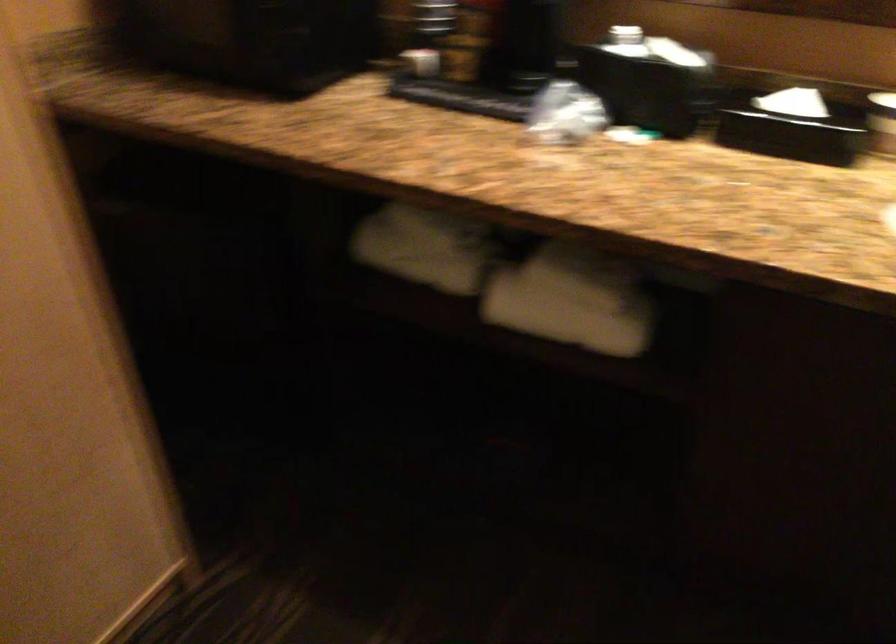
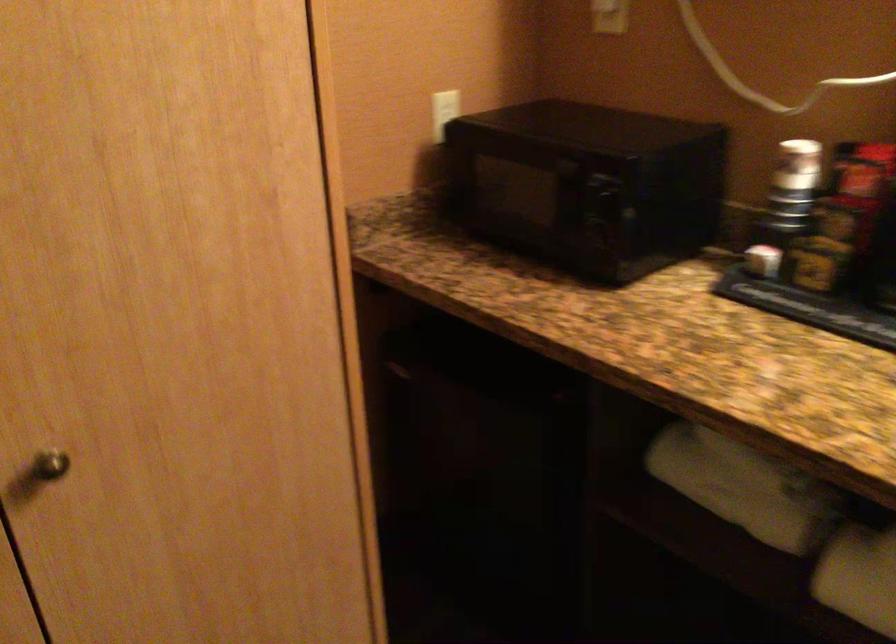
Question: I am providing you with two images of the same scene from different viewpoints. Which of the following objects are not visible in image2?

Choices:
 (A) rolled white towel
 (B) paper cup
 (C) microwave dial
 (D) none of these

Answer: (D)